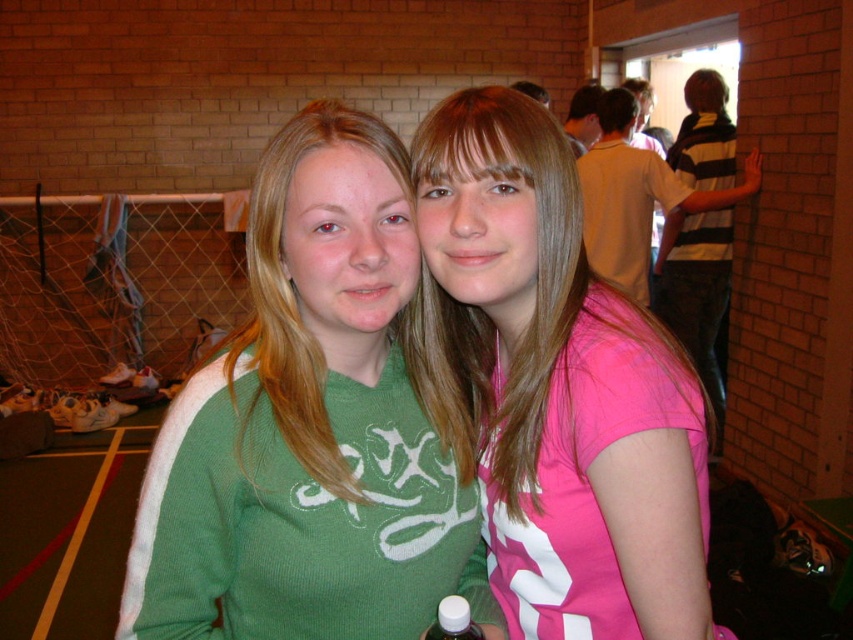
Question: Which point appears closest to the camera in this image?

Choices:
 (A) (589, 408)
 (B) (608, 275)
 (C) (334, 614)

Answer: (A)

Question: Which point appears closest to the camera in this image?

Choices:
 (A) (173, 460)
 (B) (619, 253)

Answer: (A)

Question: Does green ribbed sweater at center appear over yellow matte shirt at upper right?

Choices:
 (A) no
 (B) yes

Answer: (A)

Question: Can you confirm if pink matte shirt at center is bigger than yellow matte shirt at upper right?

Choices:
 (A) no
 (B) yes

Answer: (A)

Question: Which point is closer to the camera?

Choices:
 (A) coord(612,177)
 (B) coord(340,285)

Answer: (B)

Question: Does green ribbed sweater at center appear over yellow matte shirt at upper right?

Choices:
 (A) no
 (B) yes

Answer: (A)